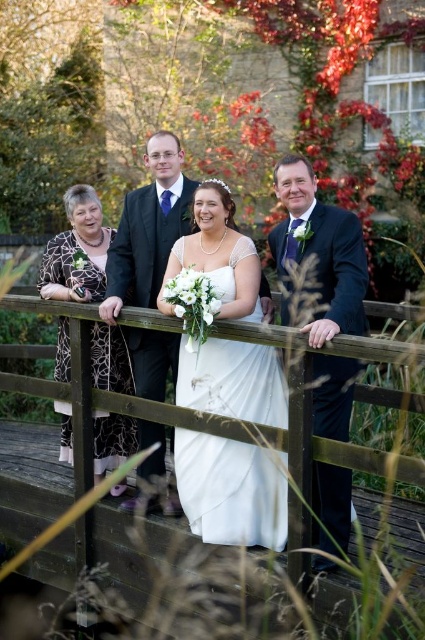
You are standing on the wooden bridge and want to place a small decoration exactly at the point with coordinates point [195,410]. Based on the scene description, can you confirm if this point is located on the wooden part of the bridge?

The point [195,410] is on wooden at center, so yes, the point is on the wooden part of the bridge.

You are a photographer holding a camera that requires a minimum of 25 inches of space to focus properly. You are positioned between the wooden at center and the matte black suit at right. Can you focus your camera on the subject in front of you?

The distance between wooden at center and matte black suit at right is 24.80 inches, which is slightly less than the required 25 inches. Therefore, the camera cannot focus properly in this position.